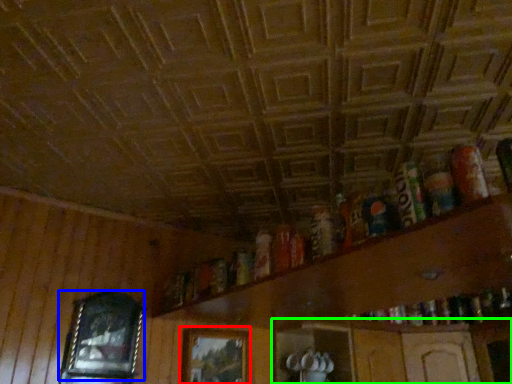
Question: Considering the real-world distances, which object is closest to picture frame (highlighted by a red box)? picture frame (highlighted by a blue box) or shelf (highlighted by a green box).

Choices:
 (A) picture frame
 (B) shelf

Answer: (A)